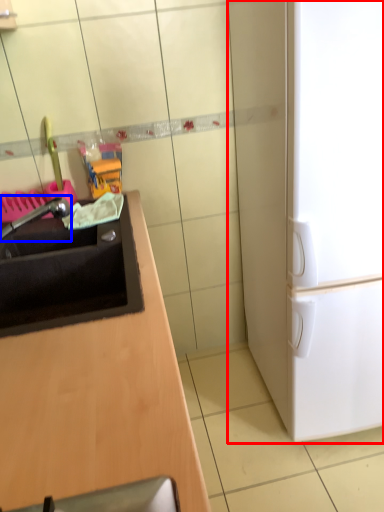
Question: Which point is further to the camera, refrigerator (highlighted by a red box) or faucet (highlighted by a blue box)?

Choices:
 (A) refrigerator
 (B) faucet

Answer: (B)